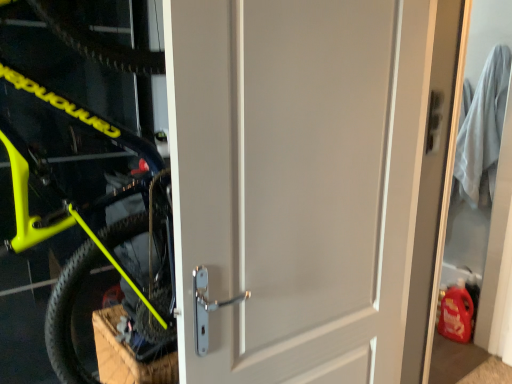
Question: Considering the positions of point pos(388,236) and point pos(449,357), is point pos(388,236) closer or farther from the camera than point pos(449,357)?

Choices:
 (A) closer
 (B) farther

Answer: (A)

Question: Is white matte door at center wider or thinner than white matte door at right?

Choices:
 (A) wide
 (B) thin

Answer: (A)

Question: Which object is positioned closest to the white matte door at right?

Choices:
 (A) white matte door at center
 (B) neon yellow matte bicycle at left

Answer: (A)

Question: Estimate the real-world distances between objects in this image. Which object is farther from the white matte door at center?

Choices:
 (A) white matte door at right
 (B) neon yellow matte bicycle at left

Answer: (A)